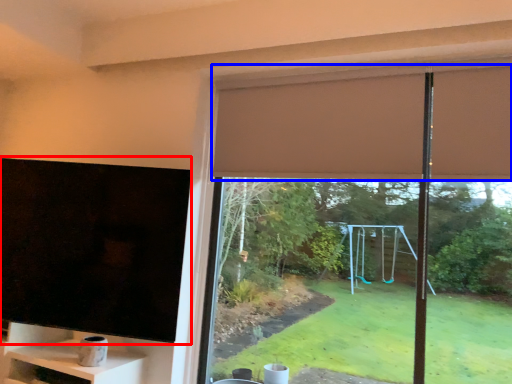
Question: Which object is further to the camera taking this photo, window screen (highlighted by a red box) or curtain (highlighted by a blue box)?

Choices:
 (A) window screen
 (B) curtain

Answer: (B)